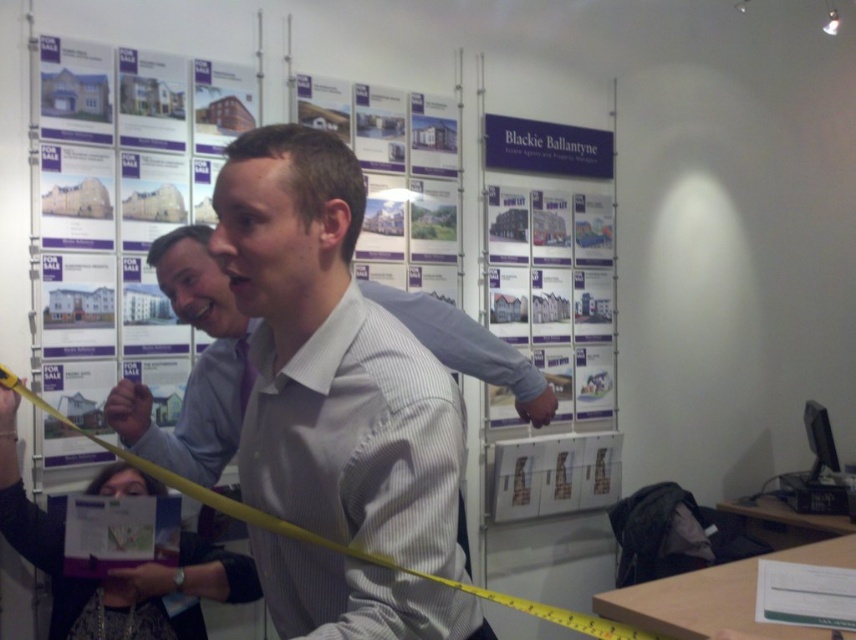
Locate an element on the screen. Image resolution: width=856 pixels, height=640 pixels. white shirt at center is located at coordinates (116, 570).

Does point (175, 627) lie behind point (201, 328)?

Yes.

Measure the distance between point (x=251, y=573) and camera.

The distance of point (x=251, y=573) from camera is 6.80 feet.

Locate an element on the screen. Image resolution: width=856 pixels, height=640 pixels. white shirt at center is located at coordinates (116, 570).